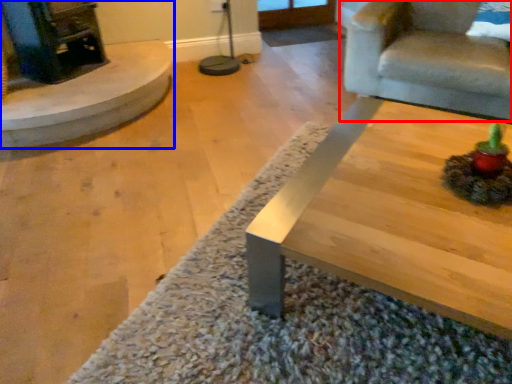
Question: Among these objects, which one is nearest to the camera, chair (highlighted by a red box) or fireplace (highlighted by a blue box)?

Choices:
 (A) chair
 (B) fireplace

Answer: (A)